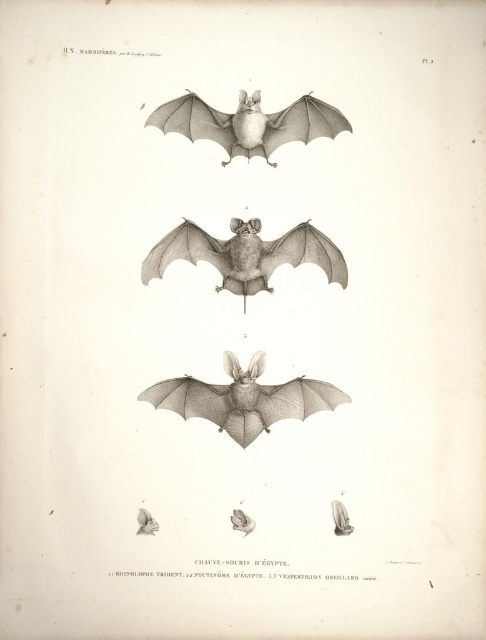
Based on the illustration of the bats, which object, the smooth gray bat at center or the matte gray wing at upper center, has a greater width?

The smooth gray bat at center might be wider than matte gray wing at upper center according to the description.

You are an art student analyzing the illustration of bats. You notice two bats labeled as smooth gray bat at center and gray pencil sketch bat at center. Which bat do you think is bigger in the illustration?

The smooth gray bat at center is larger in size than the gray pencil sketch bat at center, so the smooth gray bat at center is bigger.

You are an ornithologist examining the bat illustrations. You notice two points marked in the image. The first point is at coordinate point (190, 392) and the second is at point (281, 260). Which point is closer to you when observing the image from the front?

Point (190, 392) is in front of point (281, 260), so it is closer to you when observing the image from the front.